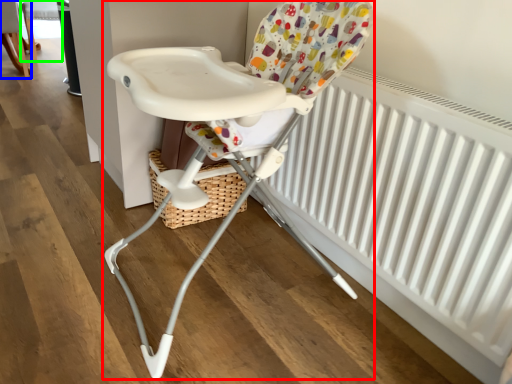
Question: Which object is the closest to the chair (highlighted by a red box)? Choose among these: chair (highlighted by a blue box) or chair (highlighted by a green box).

Choices:
 (A) chair
 (B) chair

Answer: (A)